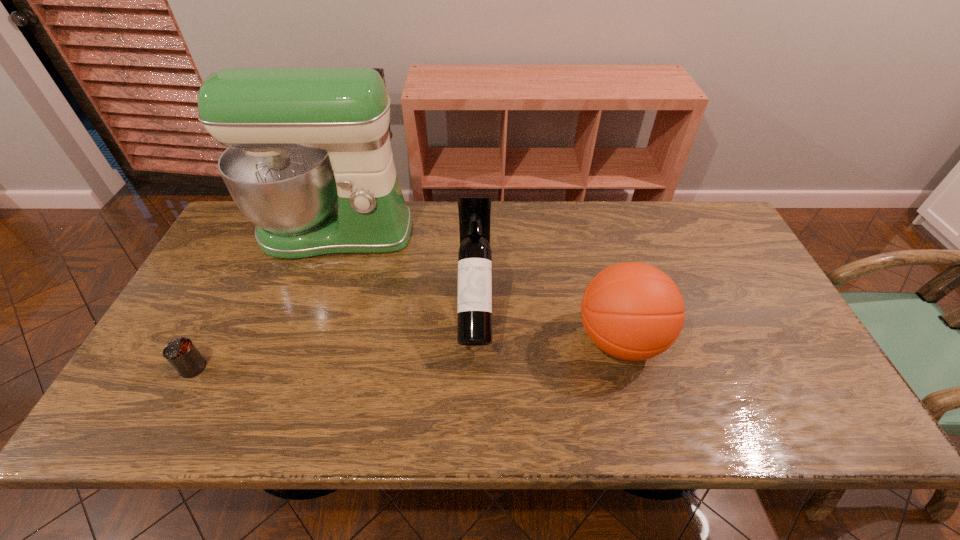
Point out which object is positioned as the third nearest to the third shortest object. Please provide its 2D coordinates. Your answer should be formatted as a tuple, i.e. [(x, y)], where the tuple contains the x and y coordinates of a point satisfying the conditions above.

[(181, 353)]

Find the location of a particular element. object that is the third nearest to the second object from right to left is located at coordinates (181, 353).

Identify the location of free space that satisfies the following two spatial constraints: 1. on the stand of the basketball; 2. on the right side of the wine bottle. This screenshot has width=960, height=540. (475, 340).